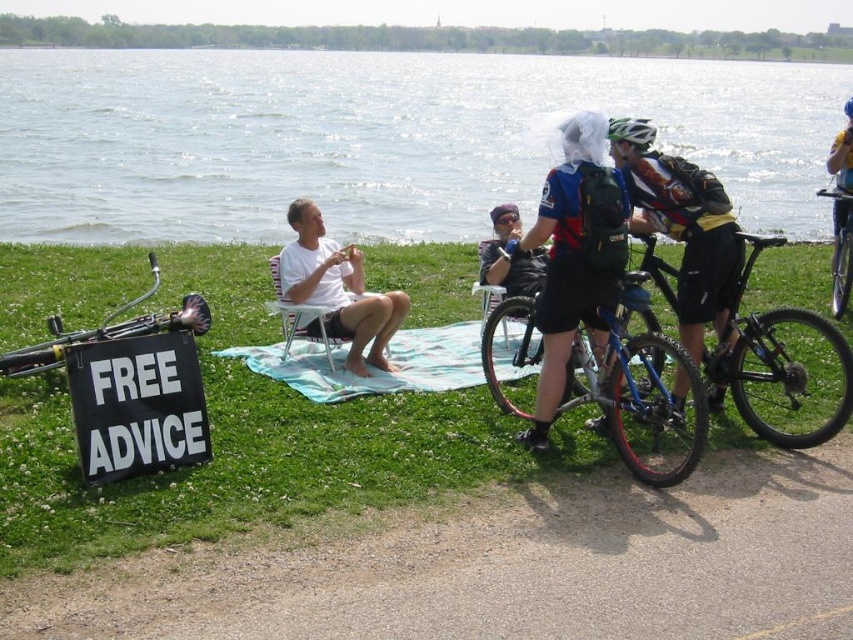
Who is more forward, (x=642, y=152) or (x=846, y=296)?

Point (x=642, y=152) is in front.

Does point (697, 212) lie in front of point (850, 257)?

Yes, it is.

Where is `shiny blue helmet at center`? shiny blue helmet at center is located at coordinates (688, 234).

The width and height of the screenshot is (853, 640). Identify the location of shiny blue helmet at center. (688, 234).

Can you confirm if green grass at lower left is positioned below green matte bicycle helmet at upper center?

Yes.

Who is more forward, (229,515) or (643,138)?

Point (229,515)

Find the location of a particular element. This screenshot has width=853, height=640. green grass at lower left is located at coordinates (234, 442).

Who is higher up, blue matte bicycle at center or metallic silver bicycle at lower left?

Positioned higher is metallic silver bicycle at lower left.

Measure the distance between blue matte bicycle at center and camera.

blue matte bicycle at center and camera are 5.65 meters apart from each other.

This screenshot has height=640, width=853. In order to click on blue matte bicycle at center in this screenshot , I will do `click(775, 362)`.